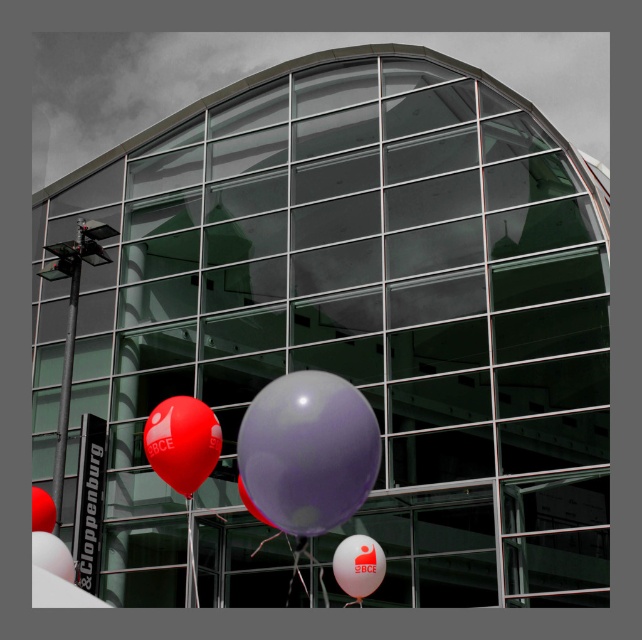
Who is more distant from viewer, (193, 403) or (243, 502)?

The point (243, 502) is behind.

Which is in front, point (177, 477) or point (275, 528)?

Point (177, 477) is more forward.

Locate an element on the screen. This screenshot has height=640, width=642. matte red balloon at center is located at coordinates (182, 442).

Does purple glossy balloon at center come behind translucent white balloon at lower center?

No, it is not.

Is purple glossy balloon at center closer to camera compared to translucent white balloon at lower center?

Yes, it is.

What are the coordinates of `purple glossy balloon at center` in the screenshot? It's located at pos(308,451).

Is rubber matte balloon at lower center positioned before purple matte balloon at center?

No, rubber matte balloon at lower center is behind purple matte balloon at center.

Which is behind, point (39, 490) or point (247, 493)?

The point (39, 490) is more distant.

Is point (35, 529) farther from camera compared to point (252, 513)?

No.

Where is `rubber matte balloon at lower center`? The width and height of the screenshot is (642, 640). rubber matte balloon at lower center is located at coordinates (42, 509).